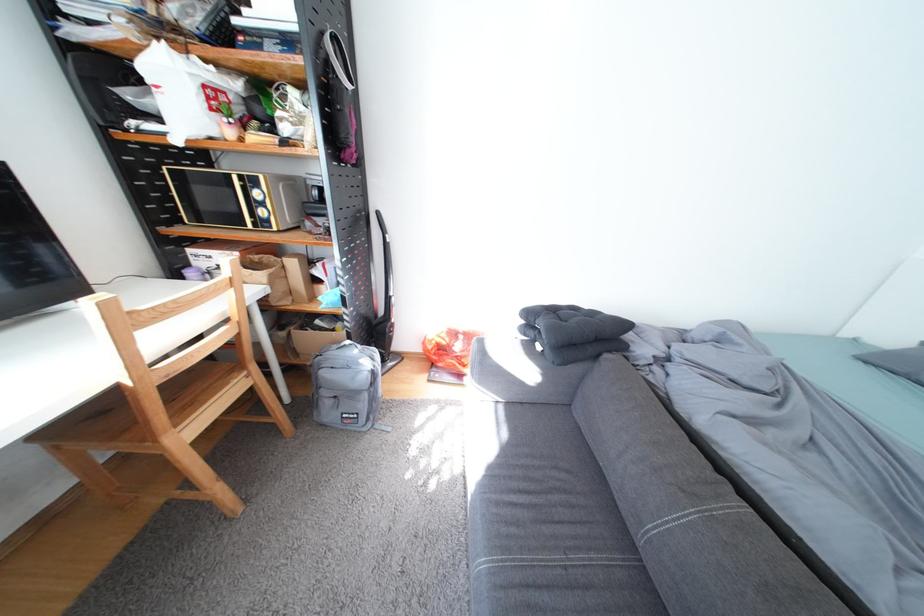
Where would you rest the grey sofa armrest? Please return your answer as a coordinate pair (x, y).

(521, 371)